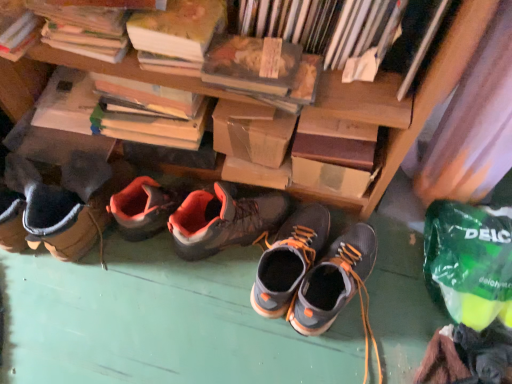
Question: Can you confirm if hardcover book at upper right, which ranks as the fourth book in left-to-right order, is bigger than hardcover book at upper left, the third book when ordered from right to left?

Choices:
 (A) yes
 (B) no

Answer: (B)

Question: Is hardcover book at upper right, which ranks as the fourth book in left-to-right order, closer to camera compared to hardcover book at upper left, which appears as the second book when viewed from the left?

Choices:
 (A) no
 (B) yes

Answer: (B)

Question: Considering the relative sizes of hardcover book at upper right, arranged as the first book when viewed from the right, and hardcover book at upper left, which appears as the second book when viewed from the left, in the image provided, is hardcover book at upper right, arranged as the first book when viewed from the right, thinner than hardcover book at upper left, which appears as the second book when viewed from the left,?

Choices:
 (A) no
 (B) yes

Answer: (A)

Question: From a real-world perspective, is hardcover book at upper right, arranged as the first book when viewed from the right, on hardcover book at upper left, which appears as the second book when viewed from the left?

Choices:
 (A) no
 (B) yes

Answer: (B)

Question: Is hardcover book at upper right, arranged as the first book when viewed from the right, located outside hardcover book at upper left, the third book when ordered from right to left?

Choices:
 (A) no
 (B) yes

Answer: (B)

Question: From a real-world perspective, is orange suede hiking boots at center, which ranks as the 1th footwear in left-to-right order, positioned above or below dark gray suede shoes at center, which appears as the second footwear when viewed from the right?

Choices:
 (A) below
 (B) above

Answer: (B)

Question: Would you say orange suede hiking boots at center, positioned as the third footwear in right-to-left order, is inside or outside dark gray suede shoes at center, placed as the second footwear when sorted from left to right?

Choices:
 (A) outside
 (B) inside

Answer: (A)

Question: Does point (190, 203) appear closer or farther from the camera than point (310, 236)?

Choices:
 (A) closer
 (B) farther

Answer: (A)

Question: Would you say orange suede hiking boots at center, positioned as the third footwear in right-to-left order, is to the left or to the right of dark gray suede shoes at center, which appears as the second footwear when viewed from the right, in the picture?

Choices:
 (A) left
 (B) right

Answer: (A)

Question: Considering their positions, is hardcover book at upper right, arranged as the first book when viewed from the right, located in front of or behind dark gray suede shoes at center, which appears as the second footwear when viewed from the right?

Choices:
 (A) front
 (B) behind

Answer: (A)

Question: From a real-world perspective, relative to dark gray suede shoes at center, placed as the second footwear when sorted from left to right, is hardcover book at upper right, arranged as the first book when viewed from the right, vertically above or below?

Choices:
 (A) below
 (B) above

Answer: (B)

Question: From the image's perspective, relative to dark gray suede shoes at center, which appears as the second footwear when viewed from the right, is hardcover book at upper right, arranged as the first book when viewed from the right, above or below?

Choices:
 (A) above
 (B) below

Answer: (A)

Question: Is hardcover book at upper right, arranged as the first book when viewed from the right, situated inside dark gray suede shoes at center, which appears as the second footwear when viewed from the right, or outside?

Choices:
 (A) outside
 (B) inside

Answer: (A)

Question: From the image's perspective, relative to matte gray and orange hiking boots at center, acting as the 1th footwear starting from the right, is orange suede hiking boots at center, positioned as the third footwear in right-to-left order, above or below?

Choices:
 (A) below
 (B) above

Answer: (B)

Question: Considering the positions of orange suede hiking boots at center, positioned as the third footwear in right-to-left order, and matte gray and orange hiking boots at center, acting as the 1th footwear starting from the right, in the image, is orange suede hiking boots at center, positioned as the third footwear in right-to-left order, wider or thinner than matte gray and orange hiking boots at center, acting as the 1th footwear starting from the right,?

Choices:
 (A) thin
 (B) wide

Answer: (B)